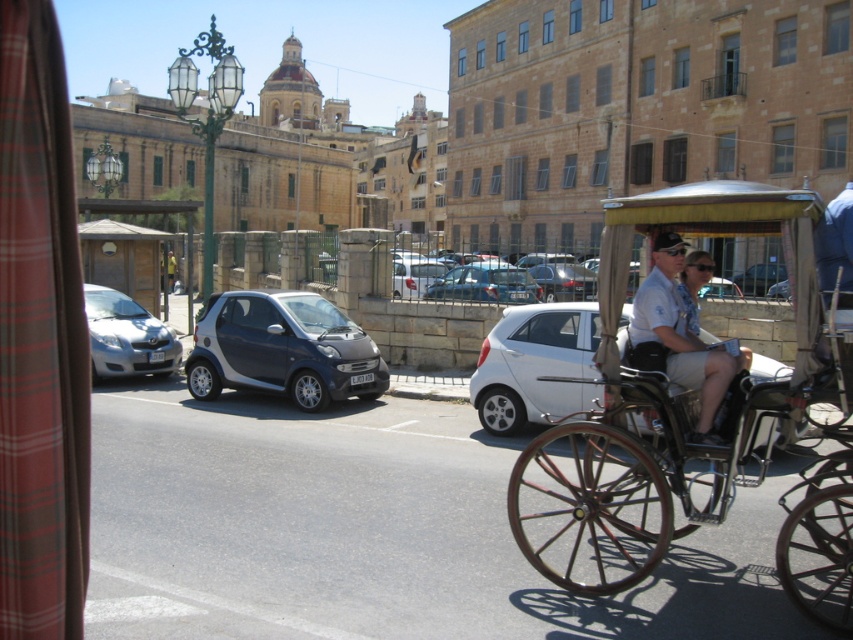
You are a tour guide explaining the historical significance of the street to visitors. You point out the metallic gray car at center and the white matte car at center. Which car do you mention as being larger?

The metallic gray car at center is bigger than the white matte car at center.

You are a delivery person standing at the entrance of the street. You need to park your delivery van, which is 6 meters long, in the street. The white matte car at center is currently occupying part of the parking space. Can you fit your van in the remaining space?

The white matte car at center is located at point (x=535, y=365). However, without knowing the total length of the parking space or the exact position and size of the remaining space, it is impossible to determine if the van will fit. Additional information about the parking area dimensions is required.

You are a delivery person who needs to park your van in the street. You see a white matte car at center and a silver metallic hatchback at left. Which vehicle should you avoid parking behind to ensure your van can pass through the space between them?

You should avoid parking behind the white matte car at center because it is positioned under the silver metallic hatchback at left, meaning there might not be enough clearance for your van to pass between them.